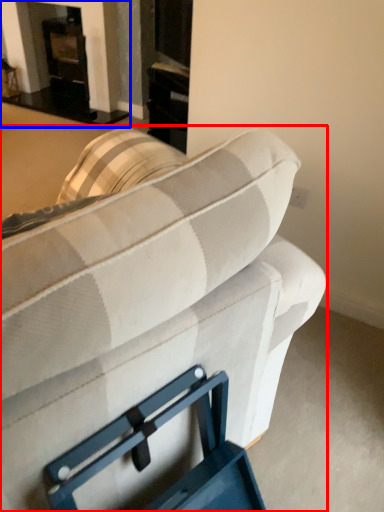
Question: Among these objects, which one is nearest to the camera, studio couch (highlighted by a red box) or fireplace (highlighted by a blue box)?

Choices:
 (A) studio couch
 (B) fireplace

Answer: (A)